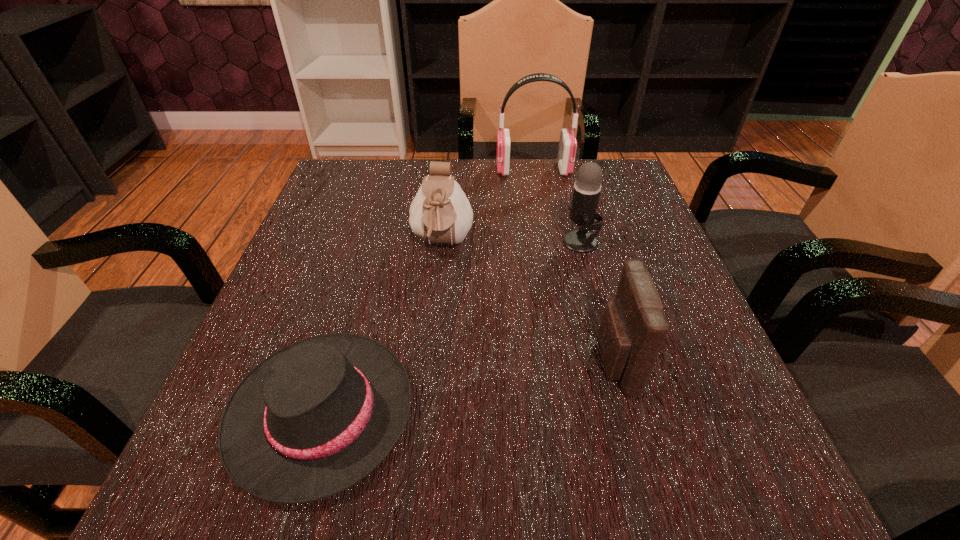
The width and height of the screenshot is (960, 540). I want to click on pouch that is at the right edge, so click(633, 328).

Where is `object located in the near left corner section of the desktop`? The height and width of the screenshot is (540, 960). object located in the near left corner section of the desktop is located at coordinates (314, 418).

Find the location of a particular element. The height and width of the screenshot is (540, 960). object at the far right corner is located at coordinates (567, 148).

In the image, there is a desktop. Identify the location of vacant space at the far edge. The width and height of the screenshot is (960, 540). (398, 162).

This screenshot has width=960, height=540. I want to click on free region at the near edge of the desktop, so click(618, 487).

Locate an element on the screen. The height and width of the screenshot is (540, 960). vacant space at the left edge of the desktop is located at coordinates (338, 227).

In the image, there is a desktop. Identify the location of free space at the right edge. The width and height of the screenshot is (960, 540). (639, 228).

The width and height of the screenshot is (960, 540). What are the coordinates of `vacant space at the far left corner of the desktop` in the screenshot? It's located at (321, 194).

Locate an element on the screen. This screenshot has height=540, width=960. free space at the near left corner of the desktop is located at coordinates (265, 504).

Identify the location of free point at the far right corner. (615, 184).